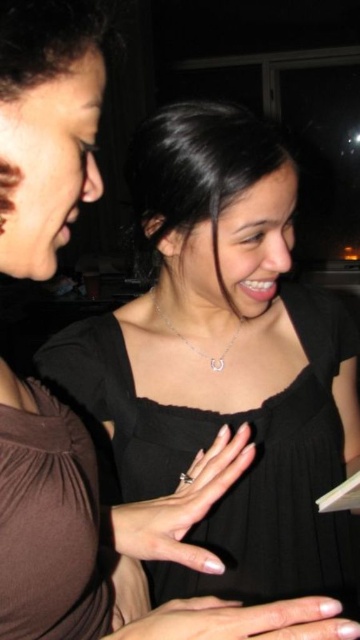
You are taking a photo of two points in the image. One is at point (312,440) and the other is at point (6,432). Which point is closer to the camera?

Point (312,440) is further to the camera than point (6,432), so the closer point to the camera is point (6,432).

You are standing in the room and want to move from the point at the top right corner to the point near the bottom left corner. Which direction should you move relative to the two points labeled as point (12, 528) and point (326, 605)?

To move from the point at the top right corner to the point near the bottom left corner, you should move towards the direction of point (12, 528) since it is in front of point (326, 605).

You are at a party and want to take a photo of the brown matte dress at lower left and the nail polish at center. Where should you position yourself to capture both items in the frame?

Position yourself to the right of the nail polish at center so that the brown matte dress at lower left, which is to the left of the nail polish at center, comes into view.